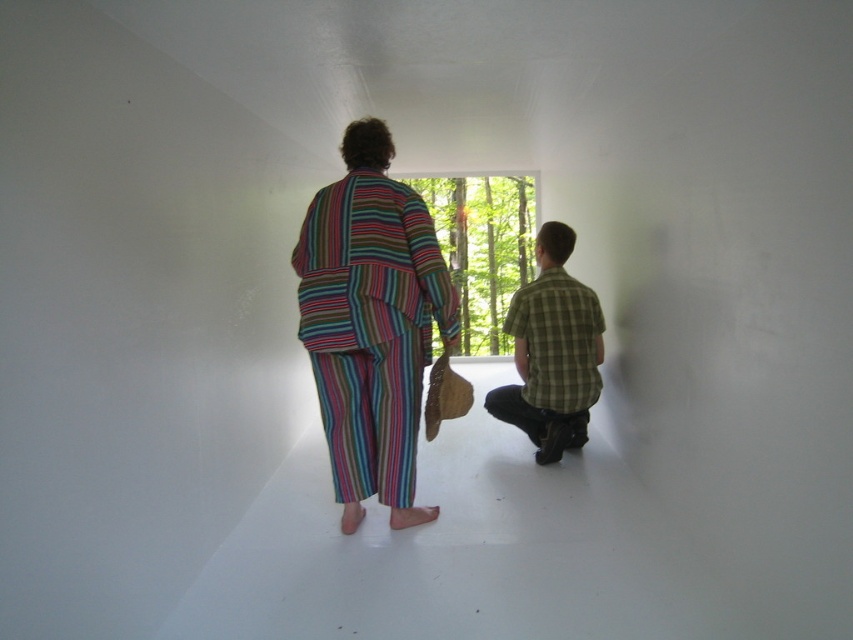
Question: Which object is closer to the camera taking this photo?

Choices:
 (A) green plaid shirt at center
 (B) multicolored striped robe at center

Answer: (B)

Question: Which object appears farthest from the camera in this image?

Choices:
 (A) green plaid shirt at center
 (B) multicolored striped robe at center

Answer: (A)

Question: Which point is farther to the camera?

Choices:
 (A) green plaid shirt at center
 (B) multicolored striped robe at center

Answer: (A)

Question: Is multicolored striped robe at center to the right of green plaid shirt at center from the viewer's perspective?

Choices:
 (A) yes
 (B) no

Answer: (B)

Question: Does multicolored striped robe at center lie in front of green plaid shirt at center?

Choices:
 (A) yes
 (B) no

Answer: (A)

Question: Is multicolored striped robe at center wider than green plaid shirt at center?

Choices:
 (A) yes
 (B) no

Answer: (A)